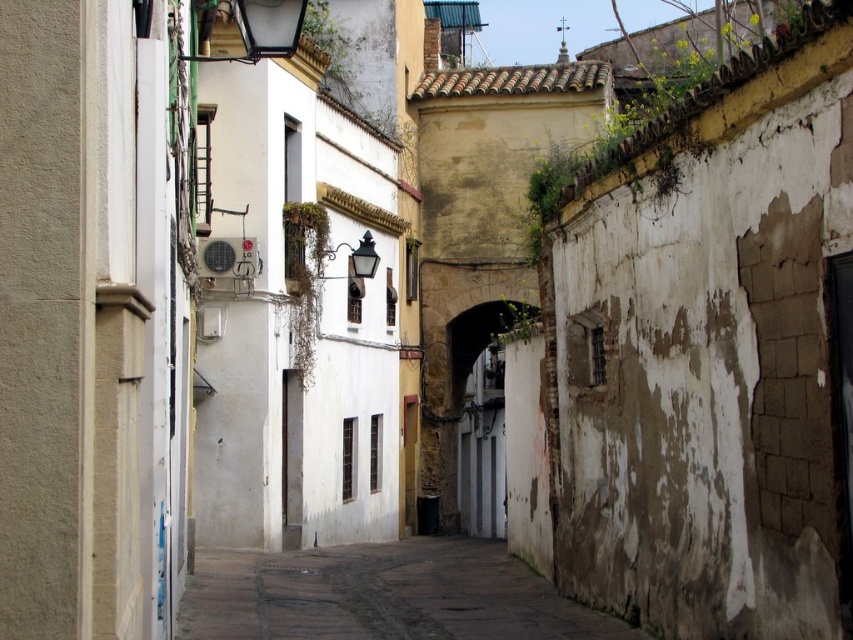
Is smooth stone alley at center below white stone archway at center?

Indeed, smooth stone alley at center is positioned under white stone archway at center.

Describe the element at coordinates (383, 595) in the screenshot. Image resolution: width=853 pixels, height=640 pixels. I see `smooth stone alley at center` at that location.

Between point (483, 554) and point (461, 417), which one is positioned behind?

The point (461, 417) is behind.

You are a GUI agent. You are given a task and a screenshot of the screen. Output one action in this format:
    pyautogui.click(x=<x>, y=<y>)
    Task: Click on the smooth stone alley at center
    Image resolution: width=853 pixels, height=640 pixels.
    Given the screenshot: What is the action you would take?
    pyautogui.click(x=383, y=595)